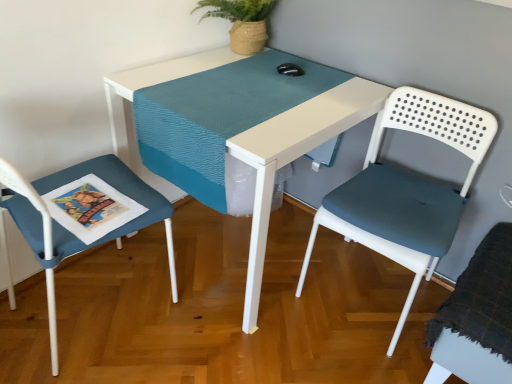
Locate an element on the screen. textured blue cushion at left, which is the third chair from right to left is located at coordinates (82, 216).

The width and height of the screenshot is (512, 384). What do you see at coordinates (477, 317) in the screenshot?
I see `textured gray cushion at right, marked as the third chair in a left-to-right arrangement` at bounding box center [477, 317].

At what (x,y) coordinates should I click in order to perform the action: click on white plastic chair at right, which appears as the 2th chair when viewed from the left. Please return your answer as a coordinate pair (x, y). Looking at the image, I should click on (407, 189).

From a real-world perspective, is textured blue cushion at left, arranged as the 1th chair when viewed from the left, over teal woven runner at center?

Actually, textured blue cushion at left, arranged as the 1th chair when viewed from the left, is physically below teal woven runner at center in the real world.

From the picture: Considering their positions, is textured blue cushion at left, arranged as the 1th chair when viewed from the left, located in front of or behind teal woven runner at center?

In the image, textured blue cushion at left, arranged as the 1th chair when viewed from the left, appears in front of teal woven runner at center.

Could you tell me if textured blue cushion at left, which is the third chair from right to left, is facing teal woven runner at center?

Yes, textured blue cushion at left, which is the third chair from right to left, faces towards teal woven runner at center.

From the image's perspective, relative to teal woven runner at center, is textured blue cushion at left, arranged as the 1th chair when viewed from the left, above or below?

Based on their image positions, textured blue cushion at left, arranged as the 1th chair when viewed from the left, is located beneath teal woven runner at center.

Looking at their sizes, would you say textured gray cushion at right, marked as the third chair in a left-to-right arrangement, is wider or thinner than white plastic table at center?

Clearly, textured gray cushion at right, marked as the third chair in a left-to-right arrangement, has less width compared to white plastic table at center.

Is there a large distance between textured gray cushion at right, marked as the third chair in a left-to-right arrangement, and white plastic table at center?

No, textured gray cushion at right, marked as the third chair in a left-to-right arrangement, is in close proximity to white plastic table at center.

Is textured gray cushion at right, marked as the third chair in a left-to-right arrangement, at the right side of white plastic table at center?

A: Indeed, textured gray cushion at right, marked as the third chair in a left-to-right arrangement, is positioned on the right side of white plastic table at center.

Between textured gray cushion at right, marked as the third chair in a left-to-right arrangement, and white plastic table at center, which one has smaller size?

Smaller between the two is textured gray cushion at right, marked as the third chair in a left-to-right arrangement.

Where is `the 1st chair below the textured blue cushion at left, which is the third chair from right to left (from a real-world perspective)`? Image resolution: width=512 pixels, height=384 pixels. the 1st chair below the textured blue cushion at left, which is the third chair from right to left (from a real-world perspective) is located at coordinates (407, 189).

From the picture: Is textured blue cushion at left, arranged as the 1th chair when viewed from the left, placed right next to white plastic chair at right, which appears as the 2th chair when viewed from the left?

No, textured blue cushion at left, arranged as the 1th chair when viewed from the left, is not making contact with white plastic chair at right, which appears as the 2th chair when viewed from the left.

Is textured blue cushion at left, which is the third chair from right to left, positioned behind white plastic chair at right, which appears as the second chair when viewed from the right?

No, textured blue cushion at left, which is the third chair from right to left, is in front of white plastic chair at right, which appears as the second chair when viewed from the right.

Which of these two, textured blue cushion at left, which is the third chair from right to left, or white plastic chair at right, which appears as the 2th chair when viewed from the left, is thinner?

white plastic chair at right, which appears as the 2th chair when viewed from the left.

Which point is more forward, [167,159] or [481,365]?

Positioned in front is point [481,365].

From the picture: Is teal woven runner at center wider than textured gray cushion at right, marked as the third chair in a left-to-right arrangement?

Correct, the width of teal woven runner at center exceeds that of textured gray cushion at right, marked as the third chair in a left-to-right arrangement.

Is teal woven runner at center inside the boundaries of textured gray cushion at right, the first chair when ordered from right to left, or outside?

The correct answer is: outside.

Is textured gray cushion at right, marked as the third chair in a left-to-right arrangement, outside of white plastic chair at right, which appears as the 2th chair when viewed from the left?

That's correct, textured gray cushion at right, marked as the third chair in a left-to-right arrangement, is outside of white plastic chair at right, which appears as the 2th chair when viewed from the left.

Can you tell me how much textured gray cushion at right, marked as the third chair in a left-to-right arrangement, and white plastic chair at right, which appears as the second chair when viewed from the right, differ in facing direction?

textured gray cushion at right, marked as the third chair in a left-to-right arrangement, and white plastic chair at right, which appears as the second chair when viewed from the right, are facing 0.222 degrees away from each other.

From the image's perspective, is textured gray cushion at right, marked as the third chair in a left-to-right arrangement, above or below white plastic chair at right, which appears as the second chair when viewed from the right?

textured gray cushion at right, marked as the third chair in a left-to-right arrangement, is situated lower than white plastic chair at right, which appears as the second chair when viewed from the right, in the image.

Is point (396, 229) positioned after point (463, 327)?

Yes, it is behind point (463, 327).

From the image's perspective, does white plastic chair at right, which appears as the 2th chair when viewed from the left, appear higher than textured gray cushion at right, marked as the third chair in a left-to-right arrangement?

Yes, from the image's perspective, white plastic chair at right, which appears as the 2th chair when viewed from the left, is over textured gray cushion at right, marked as the third chair in a left-to-right arrangement.

Between white plastic chair at right, which appears as the 2th chair when viewed from the left, and textured gray cushion at right, the first chair when ordered from right to left, which one has smaller width?

With smaller width is white plastic chair at right, which appears as the 2th chair when viewed from the left.

Looking at this image, is white plastic chair at right, which appears as the 2th chair when viewed from the left, inside the boundaries of textured gray cushion at right, marked as the third chair in a left-to-right arrangement, or outside?

white plastic chair at right, which appears as the 2th chair when viewed from the left, is outside textured gray cushion at right, marked as the third chair in a left-to-right arrangement.

From the image's perspective, would you say white plastic table at center is positioned over textured blue cushion at left, arranged as the 1th chair when viewed from the left?

Yes.

Is there a large distance between white plastic table at center and textured blue cushion at left, arranged as the 1th chair when viewed from the left?

No, white plastic table at center is not far away from textured blue cushion at left, arranged as the 1th chair when viewed from the left.

From a real-world perspective, is white plastic table at center above or below textured blue cushion at left, which is the third chair from right to left?

From a real-world perspective, white plastic table at center is physically below textured blue cushion at left, which is the third chair from right to left.

Considering the points (167, 66) and (102, 166), which point is behind, point (167, 66) or point (102, 166)?

The point (167, 66) is farther.

What are the coordinates of `the 2nd chair positioned below the teal woven runner at center (from the image's perspective)` in the screenshot? It's located at (82, 216).

Identify the location of chair below the white plastic table at center (from a real-world perspective). (477, 317).

Which object lies nearer to the anchor point textured blue cushion at left, arranged as the 1th chair when viewed from the left, teal woven runner at center or textured gray cushion at right, marked as the third chair in a left-to-right arrangement?

teal woven runner at center is closer to textured blue cushion at left, arranged as the 1th chair when viewed from the left.

In the scene shown: Which object lies further to the anchor point teal woven runner at center, textured blue cushion at left, arranged as the 1th chair when viewed from the left, or textured gray cushion at right, marked as the third chair in a left-to-right arrangement?

textured gray cushion at right, marked as the third chair in a left-to-right arrangement, lies further to teal woven runner at center than the other object.

Estimate the real-world distances between objects in this image. Which object is closer to textured gray cushion at right, marked as the third chair in a left-to-right arrangement, textured blue cushion at left, arranged as the 1th chair when viewed from the left, or white plastic chair at right, which appears as the 2th chair when viewed from the left?

The object closer to textured gray cushion at right, marked as the third chair in a left-to-right arrangement, is white plastic chair at right, which appears as the 2th chair when viewed from the left.

From the image, which object appears to be farther from white plastic table at center, white plastic chair at right, which appears as the 2th chair when viewed from the left, or textured blue cushion at left, which is the third chair from right to left?

The object further to white plastic table at center is textured blue cushion at left, which is the third chair from right to left.

Which object lies further to the anchor point white plastic chair at right, which appears as the 2th chair when viewed from the left, textured blue cushion at left, which is the third chair from right to left, or white plastic table at center?

textured blue cushion at left, which is the third chair from right to left.

Estimate the real-world distances between objects in this image. Which object is closer to white plastic chair at right, which appears as the 2th chair when viewed from the left, teal woven runner at center or textured gray cushion at right, marked as the third chair in a left-to-right arrangement?

Based on the image, textured gray cushion at right, marked as the third chair in a left-to-right arrangement, appears to be nearer to white plastic chair at right, which appears as the 2th chair when viewed from the left.

Based on their spatial positions, is textured blue cushion at left, arranged as the 1th chair when viewed from the left, or textured gray cushion at right, the first chair when ordered from right to left, closer to white plastic table at center?

Among the two, textured blue cushion at left, arranged as the 1th chair when viewed from the left, is located nearer to white plastic table at center.

Estimate the real-world distances between objects in this image. Which object is further from textured gray cushion at right, the first chair when ordered from right to left, teal woven runner at center or white plastic table at center?

teal woven runner at center lies further to textured gray cushion at right, the first chair when ordered from right to left, than the other object.

Locate an element on the screen. This screenshot has height=384, width=512. chair between white plastic table at center and textured gray cushion at right, the first chair when ordered from right to left is located at coordinates (407, 189).

Where is `chair between teal woven runner at center and textured gray cushion at right, the first chair when ordered from right to left, in the horizontal direction`? This screenshot has width=512, height=384. chair between teal woven runner at center and textured gray cushion at right, the first chair when ordered from right to left, in the horizontal direction is located at coordinates (407, 189).

Identify the location of table top located between white plastic table at center and textured gray cushion at right, the first chair when ordered from right to left, in the left-right direction. Image resolution: width=512 pixels, height=384 pixels. (218, 117).

Locate an element on the screen. The width and height of the screenshot is (512, 384). table between textured blue cushion at left, arranged as the 1th chair when viewed from the left, and white plastic chair at right, which appears as the second chair when viewed from the right is located at coordinates (294, 158).